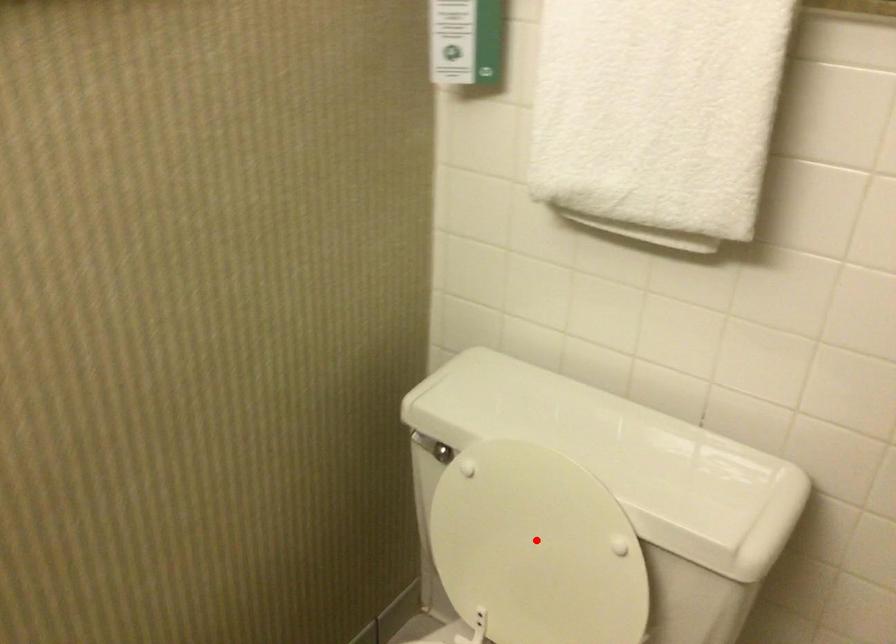
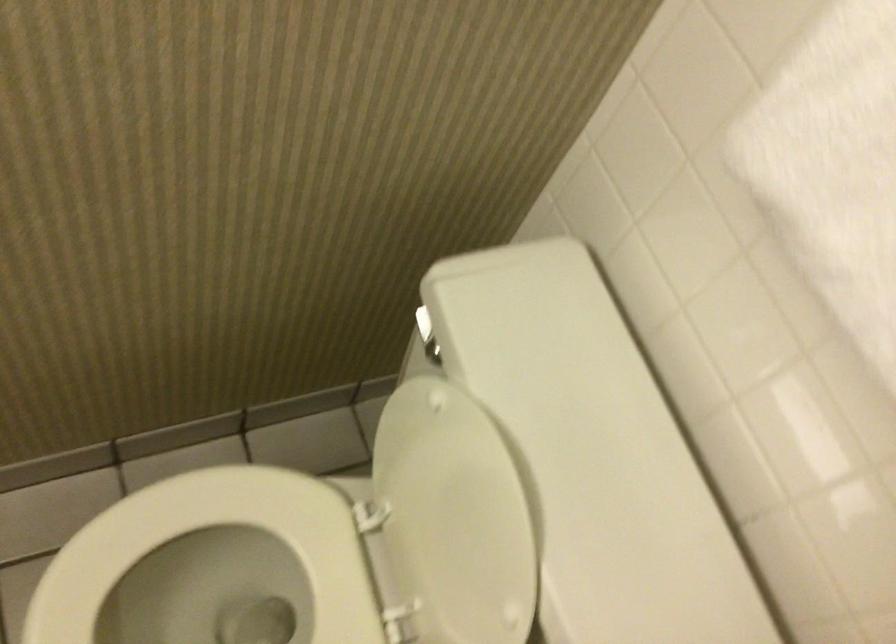
Question: I am providing you with two images of the same scene from different viewpoints. Image1 has a red point marked. In image2, the corresponding 3D location appears at what relative position? Reply with the corresponding letter.

Choices:
 (A) Closer
 (B) Farther

Answer: (A)